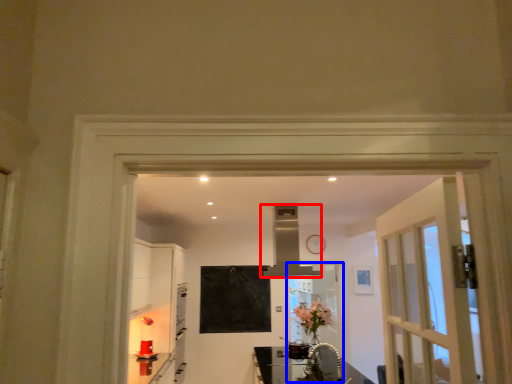
Question: Which point is closer to the camera, exhaust hood (highlighted by a red box) or screen door (highlighted by a blue box)?

Choices:
 (A) exhaust hood
 (B) screen door

Answer: (A)